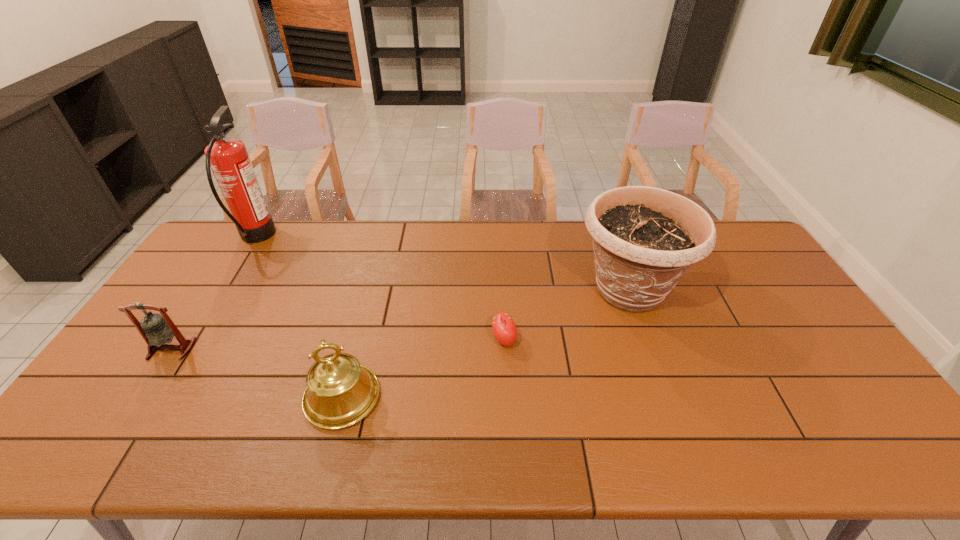
This screenshot has width=960, height=540. Find the location of `free point between the fire extinguisher and the shortest object`. free point between the fire extinguisher and the shortest object is located at coordinates (380, 289).

The image size is (960, 540). I want to click on vacant area that lies between the nearer bell and the fire extinguisher, so click(299, 318).

What are the coordinates of `empty space that is in between the left bell and the nearest object` in the screenshot? It's located at (257, 373).

Where is `vacant area between the nearer bell and the flowerpot`? The width and height of the screenshot is (960, 540). vacant area between the nearer bell and the flowerpot is located at coordinates (486, 343).

At what (x,y) coordinates should I click in order to perform the action: click on free area in between the nearer bell and the tallest object. Please return your answer as a coordinate pair (x, y). This screenshot has width=960, height=540. Looking at the image, I should click on (299, 318).

You are a GUI agent. You are given a task and a screenshot of the screen. Output one action in this format:
    pyautogui.click(x=<x>, y=<y>)
    Task: Click on the object that is the second nearest to the shorter bell
    The width and height of the screenshot is (960, 540).
    Given the screenshot: What is the action you would take?
    pyautogui.click(x=340, y=392)

This screenshot has height=540, width=960. Identify the location of object that stands as the second closest to the shortest object. (340, 392).

In order to click on vacant area in the image that satisfies the following two spatial constraints: 1. on the front-facing side of the tallest object; 2. on the left side of the apple in this screenshot , I will do pyautogui.click(x=192, y=340).

The width and height of the screenshot is (960, 540). I want to click on free region that satisfies the following two spatial constraints: 1. on the front-facing side of the fire extinguisher; 2. on the left side of the nearest object, so click(x=156, y=397).

What are the coordinates of `vacant space that satisfies the following two spatial constraints: 1. on the front-facing side of the tallest object; 2. on the right side of the fourth object from left to right` in the screenshot? It's located at (192, 340).